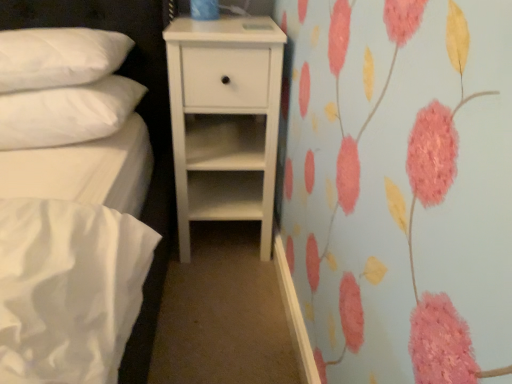
Question: Is white soft pillow at upper left, arranged as the second pillow when viewed from the top, oriented away from white matte chest of drawers at center?

Choices:
 (A) yes
 (B) no

Answer: (B)

Question: Is white soft pillow at upper left, marked as the 1th pillow in a bottom-to-top arrangement, positioned behind white matte chest of drawers at center?

Choices:
 (A) yes
 (B) no

Answer: (B)

Question: Is white soft pillow at upper left, marked as the 1th pillow in a bottom-to-top arrangement, facing towards white matte chest of drawers at center?

Choices:
 (A) yes
 (B) no

Answer: (B)

Question: Does white soft pillow at upper left, marked as the 1th pillow in a bottom-to-top arrangement, have a larger size compared to white matte chest of drawers at center?

Choices:
 (A) yes
 (B) no

Answer: (B)

Question: Does white soft pillow at upper left, marked as the 1th pillow in a bottom-to-top arrangement, have a lesser height compared to white matte chest of drawers at center?

Choices:
 (A) no
 (B) yes

Answer: (B)

Question: From a real-world perspective, does white soft pillow at upper left, marked as the 1th pillow in a bottom-to-top arrangement, stand above white matte chest of drawers at center?

Choices:
 (A) yes
 (B) no

Answer: (A)

Question: Considering the relative sizes of white quilted pillow at upper left, which is the first pillow from top to bottom, and white matte chest of drawers at center in the image provided, is white quilted pillow at upper left, which is the first pillow from top to bottom, wider than white matte chest of drawers at center?

Choices:
 (A) no
 (B) yes

Answer: (A)

Question: From a real-world perspective, is white quilted pillow at upper left, which is the first pillow from top to bottom, positioned under white matte chest of drawers at center based on gravity?

Choices:
 (A) yes
 (B) no

Answer: (B)

Question: Is white quilted pillow at upper left, the 2th pillow positioned from the bottom, closer to the viewer compared to white matte chest of drawers at center?

Choices:
 (A) no
 (B) yes

Answer: (B)

Question: Is white quilted pillow at upper left, the 2th pillow positioned from the bottom, next to white matte chest of drawers at center and touching it?

Choices:
 (A) no
 (B) yes

Answer: (A)

Question: From the image's perspective, is white quilted pillow at upper left, the 2th pillow positioned from the bottom, on top of white matte chest of drawers at center?

Choices:
 (A) no
 (B) yes

Answer: (B)

Question: Is white quilted pillow at upper left, the 2th pillow positioned from the bottom, aimed at white matte chest of drawers at center?

Choices:
 (A) no
 (B) yes

Answer: (A)

Question: From a real-world perspective, is white quilted pillow at upper left, which is the first pillow from top to bottom, on top of white soft pillow at upper left, marked as the 1th pillow in a bottom-to-top arrangement?

Choices:
 (A) yes
 (B) no

Answer: (A)